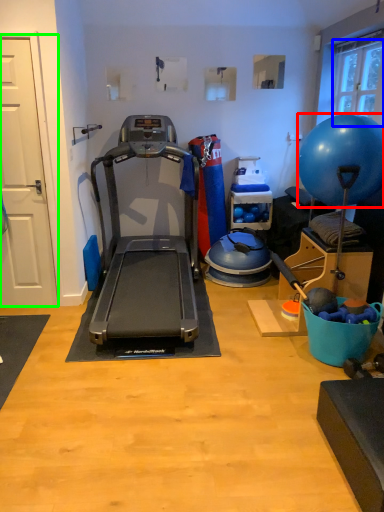
Question: Considering the real-world distances, which object is closest to ball (highlighted by a red box)? window screen (highlighted by a blue box) or door (highlighted by a green box).

Choices:
 (A) window screen
 (B) door

Answer: (A)